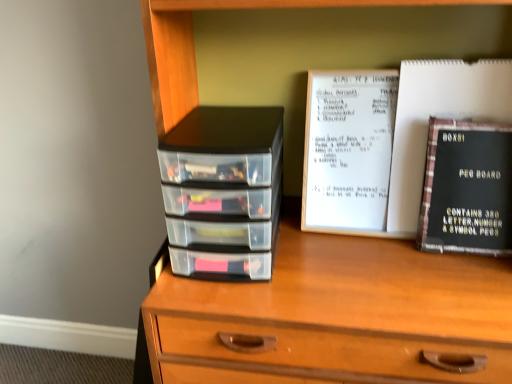
Question: Considering the relative sizes of transparent plastic drawers at left and black matte peg board at right in the image provided, is transparent plastic drawers at left taller than black matte peg board at right?

Choices:
 (A) yes
 (B) no

Answer: (B)

Question: Is transparent plastic drawers at left aimed at black matte peg board at right?

Choices:
 (A) no
 (B) yes

Answer: (A)

Question: Can you confirm if transparent plastic drawers at left is positioned to the right of black matte peg board at right?

Choices:
 (A) yes
 (B) no

Answer: (B)

Question: Would you say transparent plastic drawers at left is outside black matte peg board at right?

Choices:
 (A) no
 (B) yes

Answer: (B)

Question: From a real-world perspective, is transparent plastic drawers at left beneath black matte peg board at right?

Choices:
 (A) yes
 (B) no

Answer: (A)

Question: Considering the positions of point (397, 134) and point (261, 241), is point (397, 134) closer or farther from the camera than point (261, 241)?

Choices:
 (A) farther
 (B) closer

Answer: (A)

Question: From the image's perspective, is black matte peg board at right located above or below transparent plastic drawers at left?

Choices:
 (A) below
 (B) above

Answer: (B)

Question: Considering the positions of black matte peg board at right and transparent plastic drawers at left in the image, is black matte peg board at right taller or shorter than transparent plastic drawers at left?

Choices:
 (A) short
 (B) tall

Answer: (B)

Question: Considering the positions of black matte peg board at right and transparent plastic drawers at left in the image, is black matte peg board at right bigger or smaller than transparent plastic drawers at left?

Choices:
 (A) small
 (B) big

Answer: (A)

Question: From the image's perspective, is wooden chest of drawers at center above or below transparent plastic drawers at left?

Choices:
 (A) below
 (B) above

Answer: (A)

Question: Is wooden chest of drawers at center bigger or smaller than transparent plastic drawers at left?

Choices:
 (A) small
 (B) big

Answer: (B)

Question: From a real-world perspective, is wooden chest of drawers at center above or below transparent plastic drawers at left?

Choices:
 (A) above
 (B) below

Answer: (B)

Question: In the image, is wooden chest of drawers at center positioned in front of or behind transparent plastic drawers at left?

Choices:
 (A) front
 (B) behind

Answer: (A)

Question: Is black matte peg board at right in front of or behind wooden chest of drawers at center in the image?

Choices:
 (A) front
 (B) behind

Answer: (B)

Question: Based on their sizes in the image, would you say black matte peg board at right is bigger or smaller than wooden chest of drawers at center?

Choices:
 (A) small
 (B) big

Answer: (A)